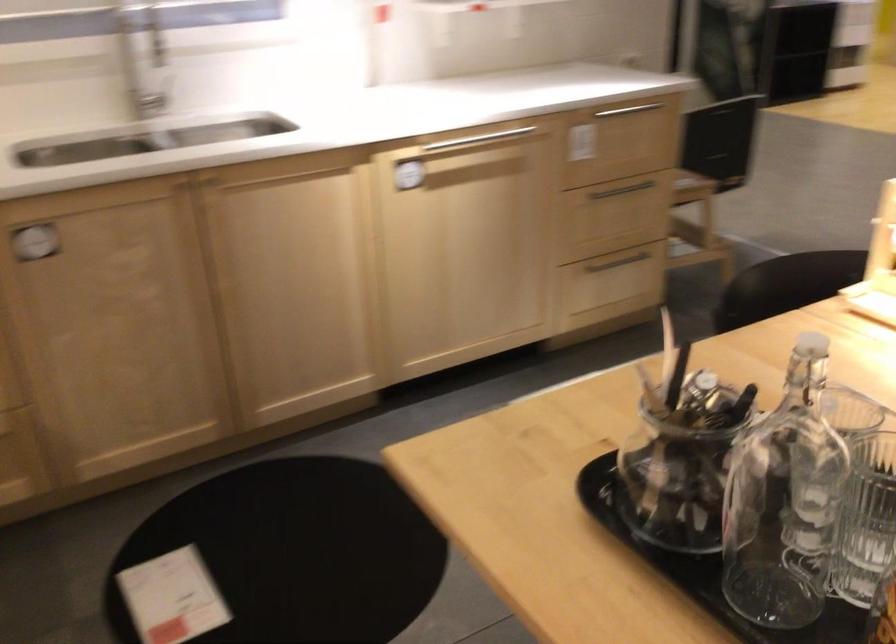
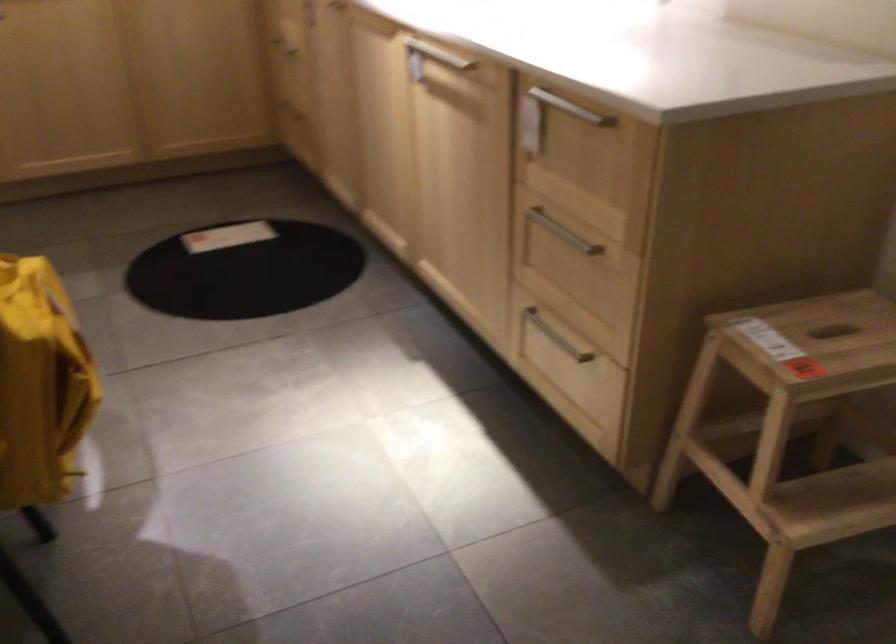
The point at [635,254] is marked in the first image. Where is the corresponding point in the second image?

(556, 337)